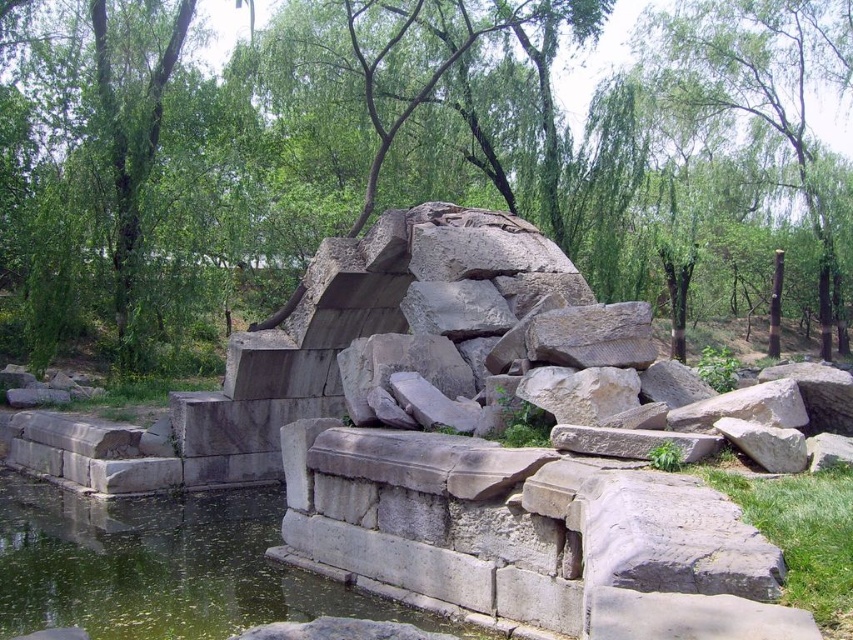
Question: In this image, where is green leafy tree at center located relative to greenish murky water at lower left?

Choices:
 (A) above
 (B) below

Answer: (A)

Question: Which object appears closest to the camera in this image?

Choices:
 (A) green leafy tree at upper center
 (B) greenish murky water at lower left

Answer: (B)

Question: Is green leafy tree at center wider than greenish murky water at lower left?

Choices:
 (A) yes
 (B) no

Answer: (A)

Question: Which is nearer to the green leafy tree at upper center?

Choices:
 (A) green leafy tree at center
 (B) greenish murky water at lower left

Answer: (A)

Question: Is green leafy tree at center below greenish murky water at lower left?

Choices:
 (A) yes
 (B) no

Answer: (B)

Question: Which point is closer to the camera taking this photo?

Choices:
 (A) (718, 104)
 (B) (119, 611)
 (C) (381, 198)

Answer: (B)